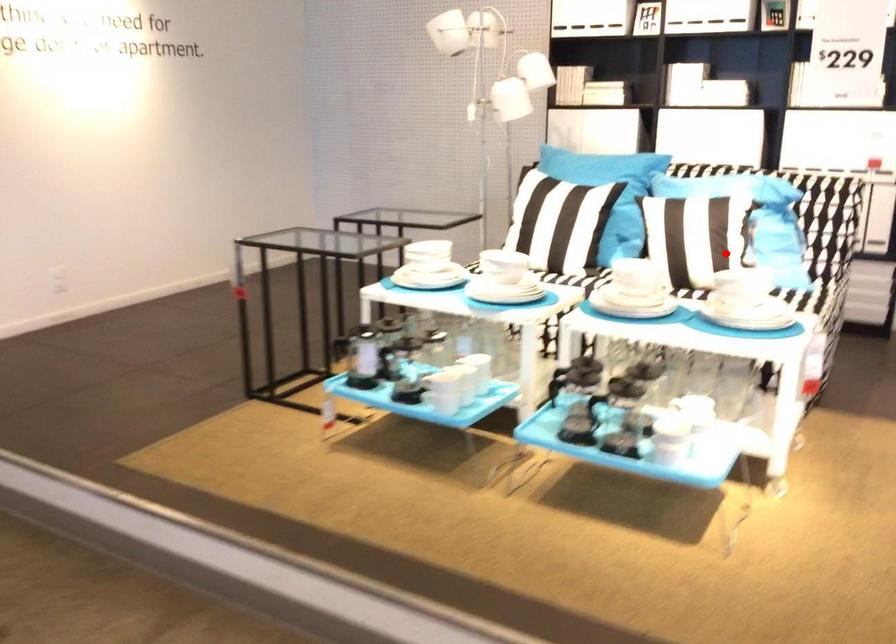
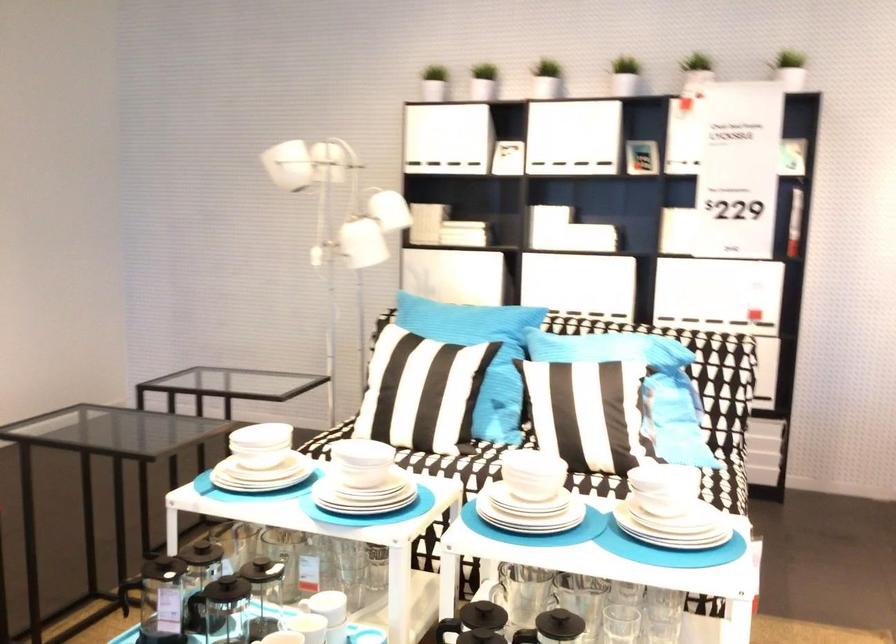
Question: I am providing you with two images of the same scene from different viewpoints. Image1 has a red point marked. In image2, the corresponding 3D location appears at what relative position? Reply with the corresponding letter.

Choices:
 (A) Closer
 (B) Farther

Answer: (A)